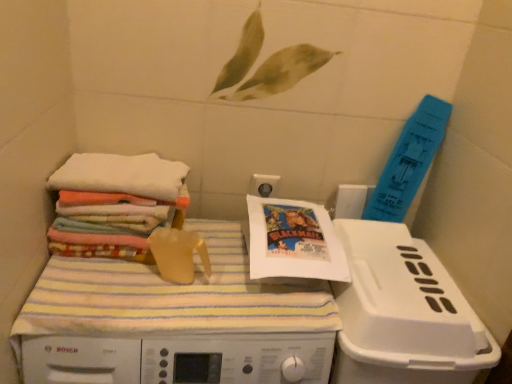
Identify the location of unoccupied area in front of white paper comic book at center. (275, 300).